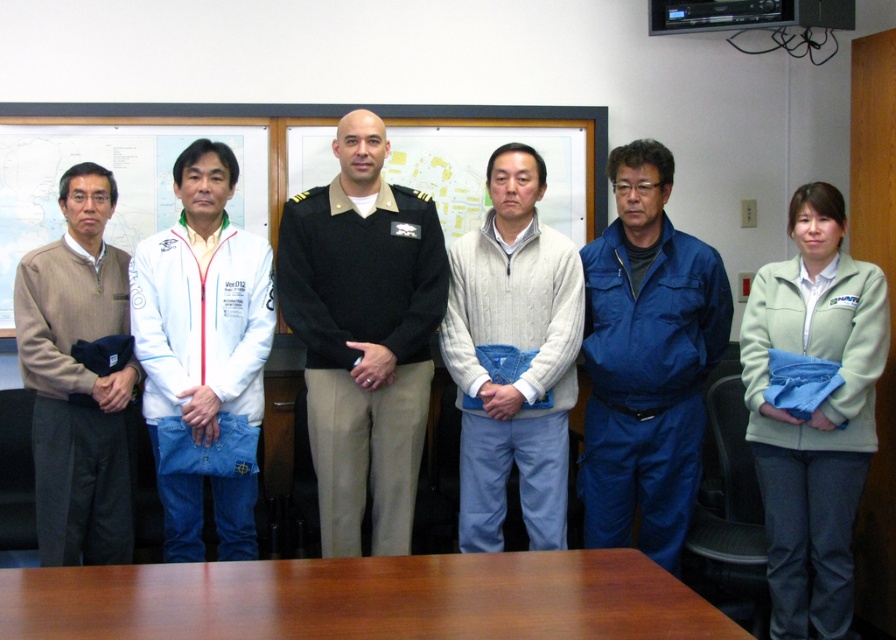
Question: Based on their relative distances, which object is farther from the white cable-knit sweater at center?

Choices:
 (A) matte white board at left
 (B) brown wooden table at center

Answer: (A)

Question: Can you confirm if brown wooden table at center is positioned to the right of black uniform at center?

Choices:
 (A) no
 (B) yes

Answer: (B)

Question: Which point is closer to the camera taking this photo?

Choices:
 (A) [x=40, y=428]
 (B) [x=173, y=372]
 (C) [x=157, y=609]
 (D) [x=135, y=228]

Answer: (C)

Question: Does light green fleece jacket at center appear under white cable-knit sweater at center?

Choices:
 (A) no
 (B) yes

Answer: (B)

Question: Is blue fabric jumpsuit at center smaller than beige textured sweater at left?

Choices:
 (A) yes
 (B) no

Answer: (B)

Question: Among these points, which one is farthest from the camera?

Choices:
 (A) (410, 467)
 (B) (102, 600)
 (C) (118, 365)

Answer: (A)